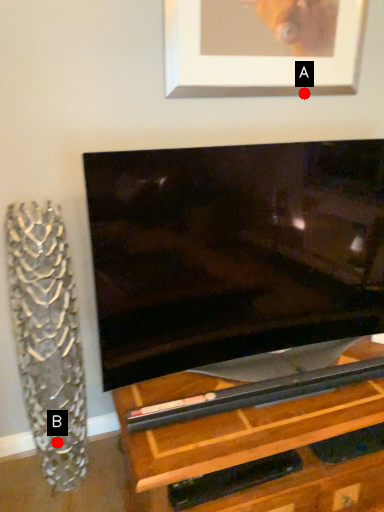
Question: Two points are circled on the image, labeled by A and B beside each circle. Which point is farther from the camera taking this photo?

Choices:
 (A) A is further
 (B) B is further

Answer: (A)